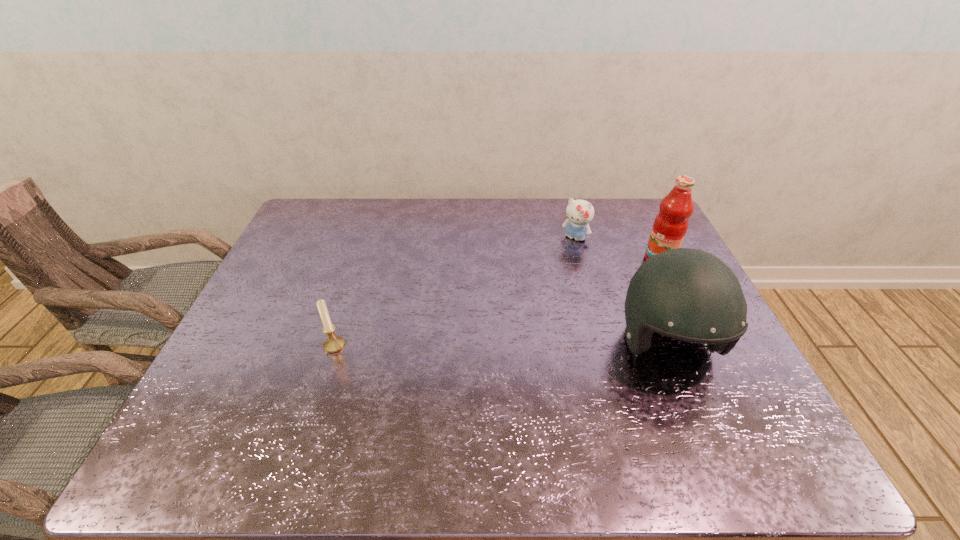
In the image, there is a desktop. Where is `vacant space at the right edge`? The width and height of the screenshot is (960, 540). vacant space at the right edge is located at coordinates (671, 349).

I want to click on free location at the far left corner of the desktop, so click(x=307, y=205).

This screenshot has height=540, width=960. Identify the location of free location at the far right corner. (641, 228).

Where is `free space that is in between the leftmost object and the farthest object`? This screenshot has height=540, width=960. free space that is in between the leftmost object and the farthest object is located at coordinates (454, 292).

Find the location of a particular element. This screenshot has width=960, height=540. empty space between the kitten and the candle holder is located at coordinates (454, 292).

Find the location of a particular element. The image size is (960, 540). empty location between the candle holder and the football helmet is located at coordinates (501, 345).

Where is `blank region between the leftmost object and the farthest object`? blank region between the leftmost object and the farthest object is located at coordinates (454, 292).

Where is `free spot between the leftmost object and the kitten`? The width and height of the screenshot is (960, 540). free spot between the leftmost object and the kitten is located at coordinates (454, 292).

You are a GUI agent. You are given a task and a screenshot of the screen. Output one action in this format:
    pyautogui.click(x=<x>, y=<y>)
    Task: Click on the free space between the second farthest object and the leftmost object
    Image resolution: width=960 pixels, height=540 pixels.
    Given the screenshot: What is the action you would take?
    [496, 302]

Where is `object that is the third closest to the kitten`? object that is the third closest to the kitten is located at coordinates (334, 343).